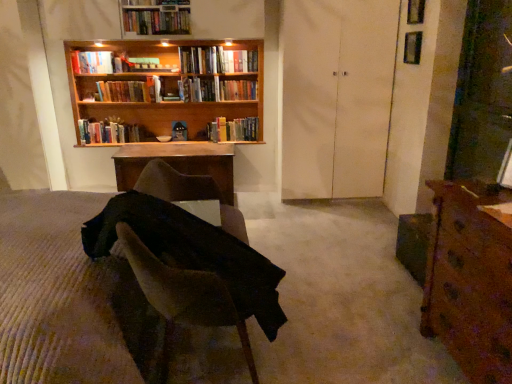
Question: Considering the positions of wooden bookshelf at upper center and hardcover books at center, arranged as the third book when viewed from the top, in the image, is wooden bookshelf at upper center taller or shorter than hardcover books at center, arranged as the third book when viewed from the top,?

Choices:
 (A) short
 (B) tall

Answer: (B)

Question: In the image, is wooden bookshelf at upper center positioned in front of or behind hardcover books at center, arranged as the third book when viewed from the top?

Choices:
 (A) front
 (B) behind

Answer: (A)

Question: Which object is positioned closest to the hardcover book at upper left, acting as the fourth book starting from the top?

Choices:
 (A) clear glass window at upper right, which is the 1th window from bottom to top
 (B) hardcover book at upper center, placed as the second book when sorted from top to bottom
 (C) hardcover books at upper left, which ranks as the sixth book in top-to-bottom order
 (D) brown wood desk at right
 (E) hardcover books at center, which is counted as the fifth book, starting from the top

Answer: (C)

Question: Which of these objects is positioned closest to the hardcover book at upper center, which ranks as the sixth book in bottom-to-top order?

Choices:
 (A) hardcover book at upper left, acting as the fourth book starting from the top
 (B) brown wood desk at right
 (C) wooden desk at center
 (D) hardcover books at upper left, which ranks as the sixth book in top-to-bottom order
 (E) hardcover books at center, acting as the 7th book starting from the top

Answer: (D)